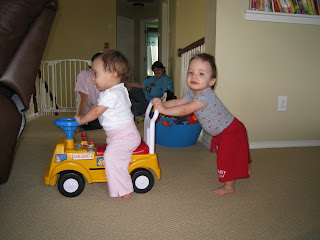
Locate an element on the screen. This screenshot has height=240, width=320. light brown carpet is located at coordinates (16, 219).